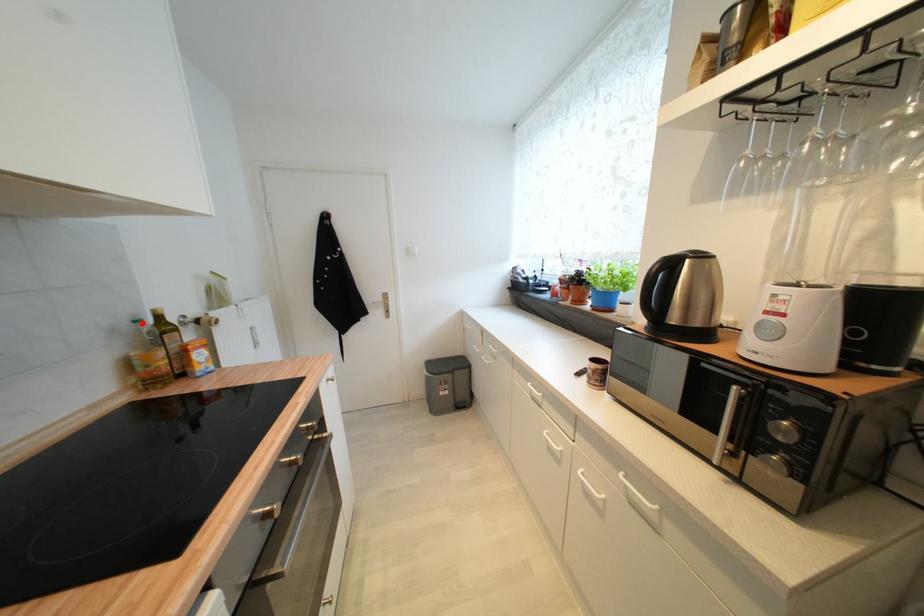
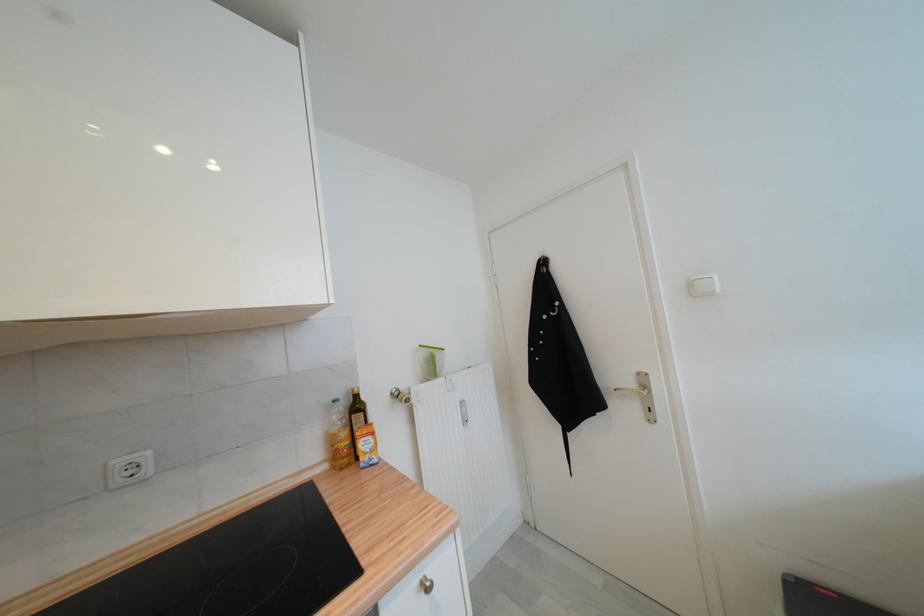
In the second image, find the point that corresponds to the highlighted location in the first image.

(339, 403)